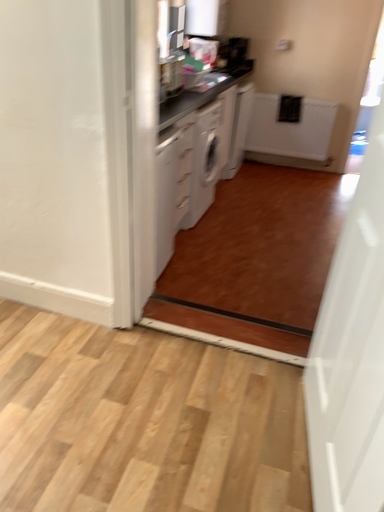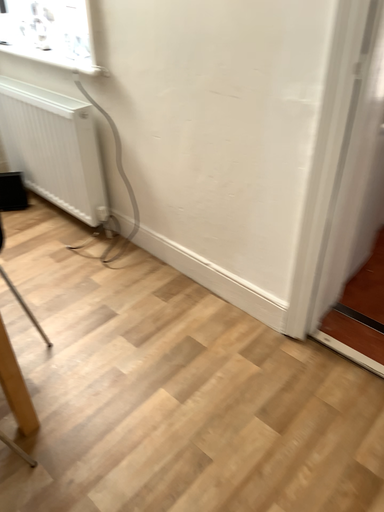
Question: How did the camera likely rotate when shooting the video?

Choices:
 (A) rotated right
 (B) rotated left

Answer: (B)